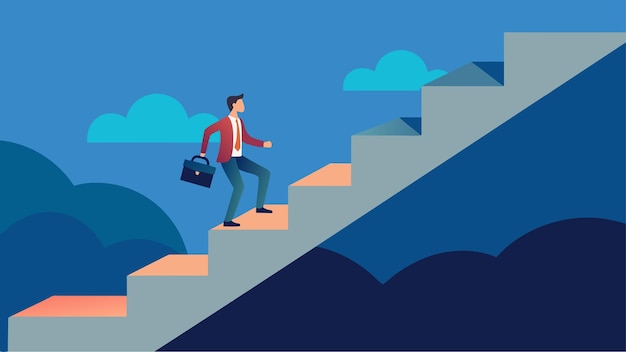
Locate an element on the screen. The image size is (626, 352). stair landings is located at coordinates (88, 301), (158, 264), (248, 222), (324, 176), (390, 118), (471, 70), (550, 26).